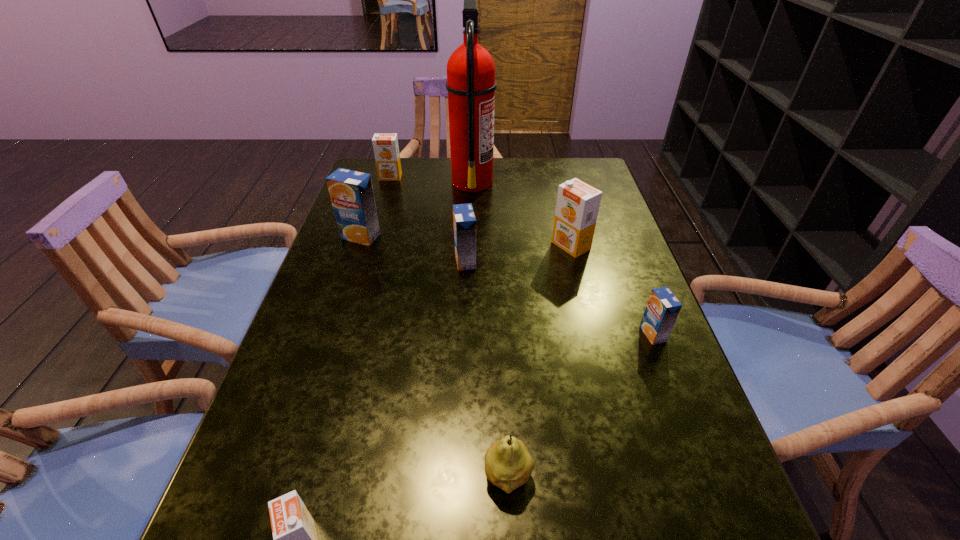
Locate an element on the screen. The image size is (960, 540). the tallest object is located at coordinates (471, 85).

At what (x,y) coordinates should I click in order to perform the action: click on the biggest blue orange_juice. Please return your answer as a coordinate pair (x, y). Looking at the image, I should click on (351, 192).

The width and height of the screenshot is (960, 540). In order to click on the farthest blue orange_juice in this screenshot , I will do `click(351, 192)`.

Image resolution: width=960 pixels, height=540 pixels. Identify the location of the biggest orange orange juice. (577, 207).

At what (x,y) coordinates should I click in order to perform the action: click on the second orange juice from right to left. Please return your answer as a coordinate pair (x, y). The height and width of the screenshot is (540, 960). Looking at the image, I should click on (577, 207).

Locate an element on the screen. the second farthest blue orange_juice is located at coordinates (464, 222).

At what (x,y) coordinates should I click in order to perform the action: click on the second smallest blue orange_juice. Please return your answer as a coordinate pair (x, y). Looking at the image, I should click on (464, 222).

This screenshot has width=960, height=540. I want to click on the farthest orange orange juice, so click(x=386, y=150).

This screenshot has height=540, width=960. Find the location of `the farthest orange juice`. the farthest orange juice is located at coordinates (386, 150).

Locate an element on the screen. The height and width of the screenshot is (540, 960). the second nearest object is located at coordinates (508, 465).